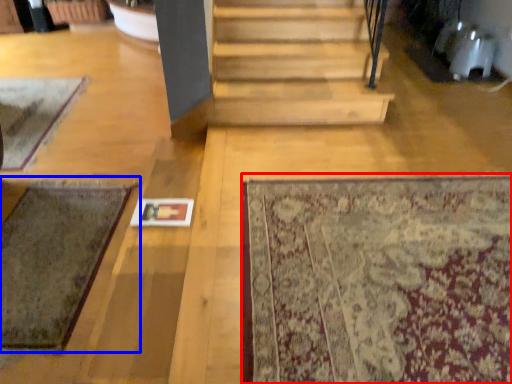
Question: Which object is closer to the camera taking this photo, mat (highlighted by a red box) or mat (highlighted by a blue box)?

Choices:
 (A) mat
 (B) mat

Answer: (A)